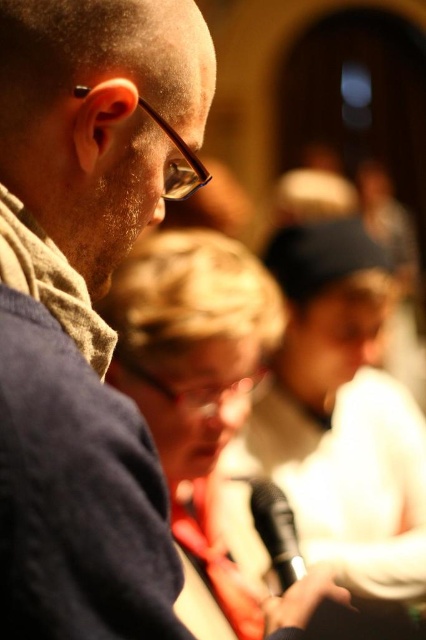
Can you confirm if matte black glasses at upper left is positioned above black matte microphone at lower center?

Yes.

This screenshot has height=640, width=426. In order to click on matte black glasses at upper left in this screenshot , I will do `click(85, 307)`.

Is point (71, 380) more distant than point (282, 504)?

No, it is not.

This screenshot has height=640, width=426. What are the coordinates of `matte black glasses at upper left` in the screenshot? It's located at (85, 307).